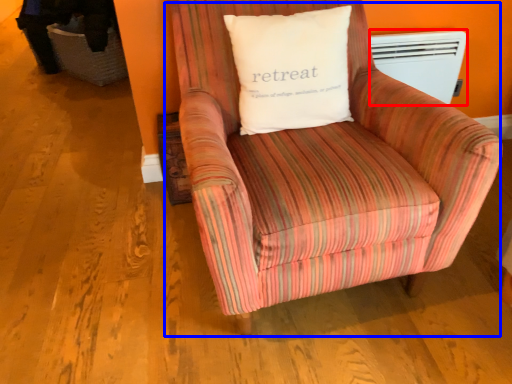
Question: Which of the following is the farthest to the observer, heater (highlighted by a red box) or chair (highlighted by a blue box)?

Choices:
 (A) heater
 (B) chair

Answer: (A)